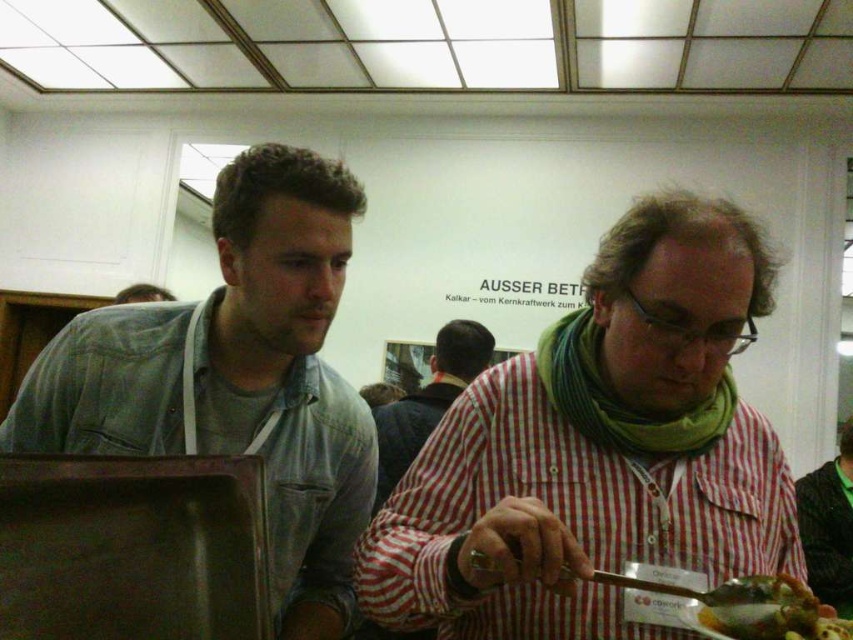
What is the exact coordinate of the red plaid shirt at center?

The red plaid shirt at center is located at point (598, 451).